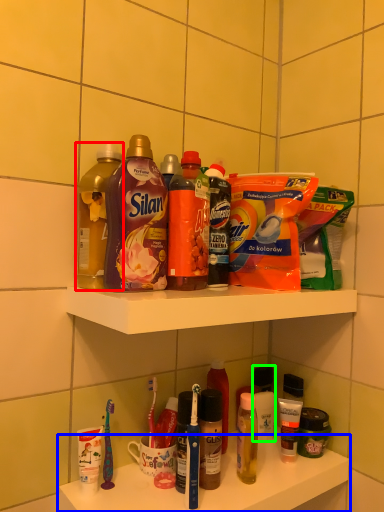
Question: Which is farther away from bottle (highlighted by a red box)? supermarket shelf (highlighted by a blue box) or toiletry (highlighted by a green box)?

Choices:
 (A) supermarket shelf
 (B) toiletry

Answer: (B)